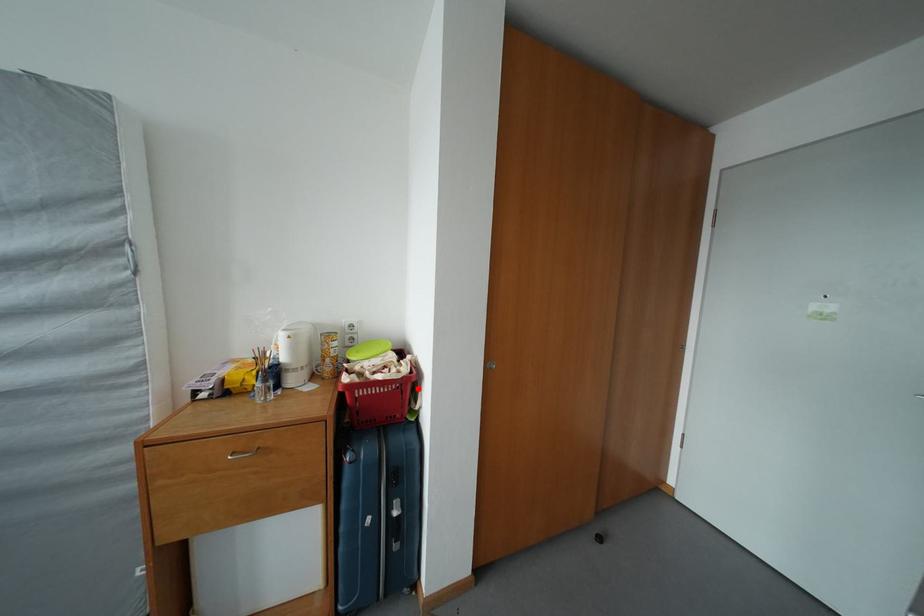
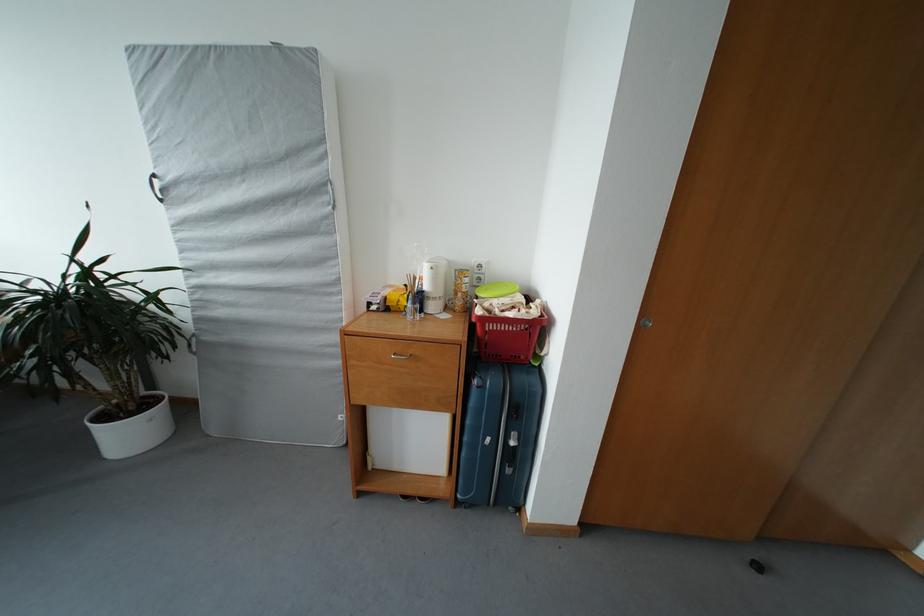
In the second image, find the point that corresponds to the highlighted location in the first image.

(546, 333)